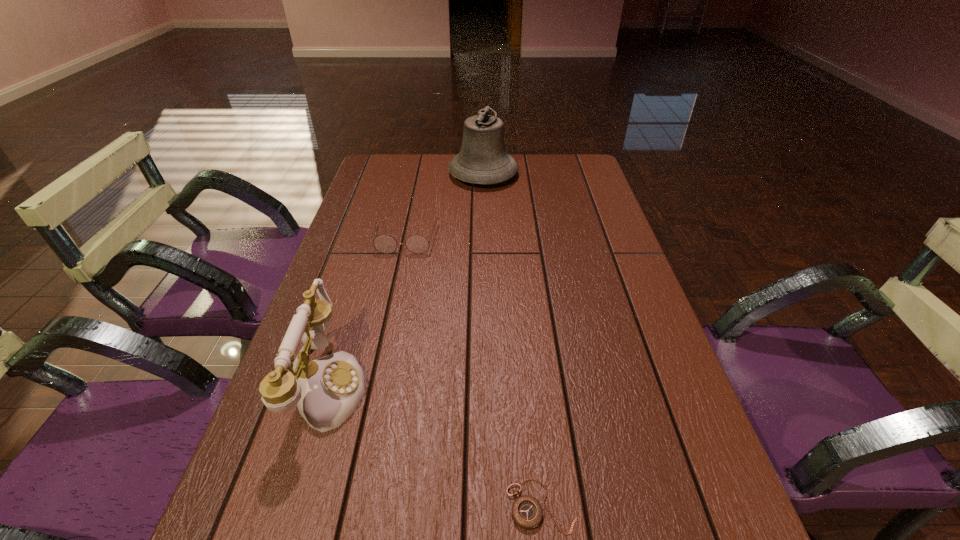
Locate an element on the screen. The height and width of the screenshot is (540, 960). the tallest object is located at coordinates (483, 159).

The width and height of the screenshot is (960, 540). What are the coordinates of `bell` in the screenshot? It's located at (483, 159).

Identify the location of telephone. (327, 391).

Find the location of a particular element. The height and width of the screenshot is (540, 960). the third farthest object is located at coordinates (327, 391).

I want to click on the second farthest object, so click(x=386, y=244).

This screenshot has height=540, width=960. What are the coordinates of `the second shortest object` in the screenshot? It's located at (386, 244).

Locate an element on the screen. The height and width of the screenshot is (540, 960). the shortest object is located at coordinates (527, 512).

Find the location of a particular element. The width and height of the screenshot is (960, 540). the nearest object is located at coordinates (527, 512).

Identify the location of free space located 0.260m on the right of the tallest object. (592, 174).

This screenshot has height=540, width=960. What are the coordinates of `vacant space located on the dial of the telephone` in the screenshot? It's located at (492, 386).